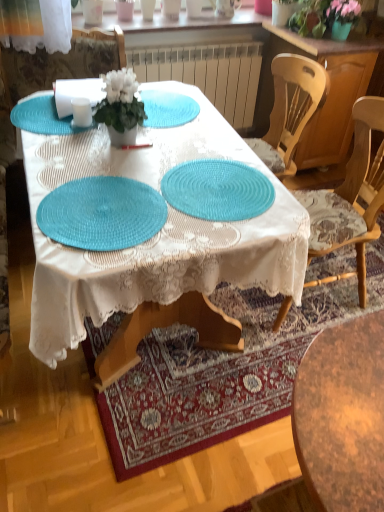
Locate an element on the screen. The image size is (384, 512). unoccupied area behind teal woven placemat at center, which ranks as the second glass plate in top-to-bottom order is located at coordinates (194, 140).